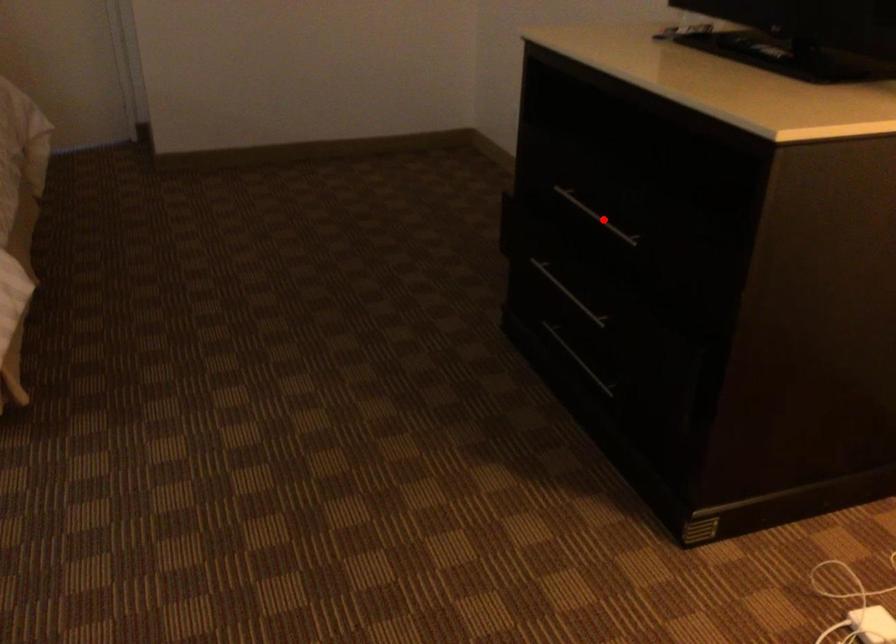
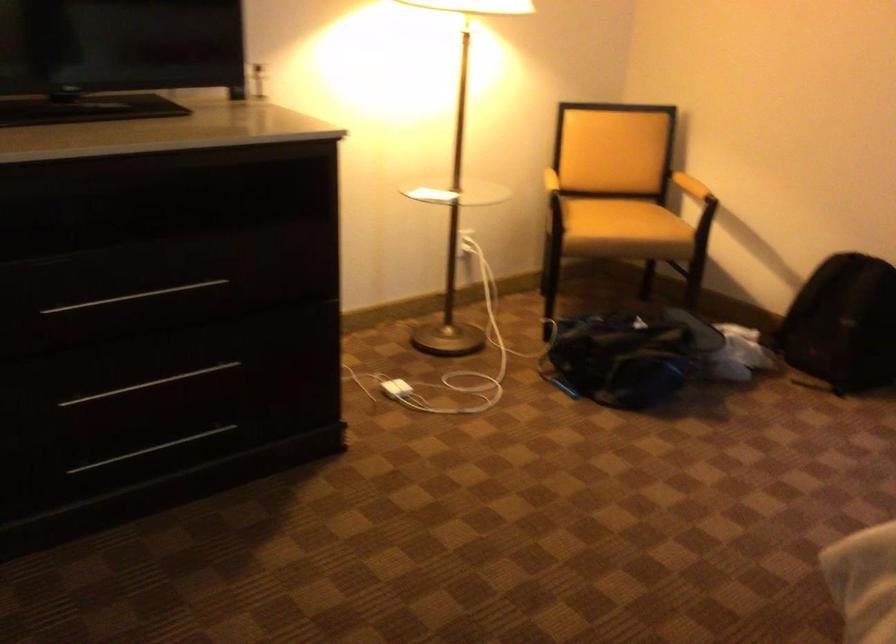
In the second image, find the point that corresponds to the highlighted location in the first image.

(134, 297)